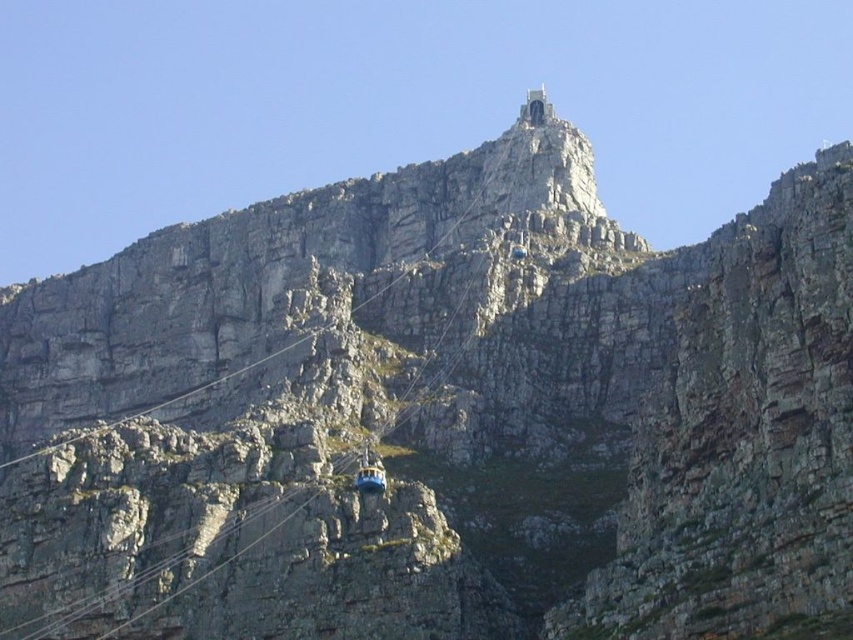
You are a mountain rescue team member assessing the cable car system. The metallic yellow cable car at center and the blue metallic cable car at upper center are both suspended on the same cable. Which cable car has a greater chance of causing instability in the cable system due to its width?

The metallic yellow cable car at center might be wider than blue metallic cable car at upper center, so it has a greater chance of causing instability in the cable system due to its width.

You are a hiker planning to climb the smooth stone peak at upper center. You notice the metallic yellow cable car at center is passing by. Which object is closer to you as you start your climb?

The smooth stone peak at upper center is closer to you than the metallic yellow cable car at center as you start your climb.

You are a hiker planning to climb the smooth stone peak at upper center. You see the metallic yellow cable car at center passing by below you. Which object is larger in size?

The smooth stone peak at upper center is bigger than the metallic yellow cable car at center according to the description provided.